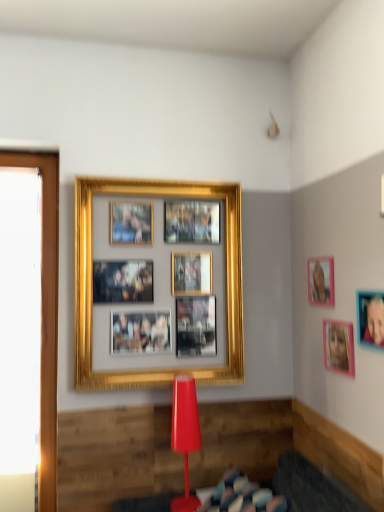
Question: From a real-world perspective, is pink matte picture frame at upper right, the 2th picture frame when ordered from left to right, physically below pink matte picture frame at upper right, positioned as the first picture frame in front-to-back order?

Choices:
 (A) yes
 (B) no

Answer: (B)

Question: Considering the relative sizes of pink matte picture frame at upper right, which appears as the 3th picture frame when viewed from the right, and pink matte picture frame at upper right, positioned as the first picture frame in front-to-back order, in the image provided, is pink matte picture frame at upper right, which appears as the 3th picture frame when viewed from the right, shorter than pink matte picture frame at upper right, positioned as the first picture frame in front-to-back order,?

Choices:
 (A) no
 (B) yes

Answer: (A)

Question: Is pink matte picture frame at upper right, acting as the 2th picture frame starting from the back, in front of pink matte picture frame at upper right, the 1th picture frame viewed from the right?

Choices:
 (A) yes
 (B) no

Answer: (B)

Question: Is pink matte picture frame at upper right, the 2th picture frame when ordered from left to right, positioned behind pink matte picture frame at upper right, positioned as the first picture frame in front-to-back order?

Choices:
 (A) no
 (B) yes

Answer: (B)

Question: Considering the relative sizes of pink matte picture frame at upper right, the 2th picture frame when ordered from left to right, and pink matte picture frame at upper right, the 1th picture frame viewed from the right, in the image provided, is pink matte picture frame at upper right, the 2th picture frame when ordered from left to right, bigger than pink matte picture frame at upper right, the 1th picture frame viewed from the right,?

Choices:
 (A) no
 (B) yes

Answer: (B)

Question: Is pink matte picture frame at upper right, acting as the 2th picture frame starting from the back, directly adjacent to pink matte picture frame at upper right, the fourth picture frame in the back-to-front sequence?

Choices:
 (A) no
 (B) yes

Answer: (A)

Question: Does matte red table lamp at center touch pink matte picture frame at upper right, positioned as the first picture frame in front-to-back order?

Choices:
 (A) no
 (B) yes

Answer: (A)

Question: Considering the relative sizes of matte red table lamp at center and pink matte picture frame at upper right, the 1th picture frame viewed from the right, in the image provided, is matte red table lamp at center bigger than pink matte picture frame at upper right, the 1th picture frame viewed from the right,?

Choices:
 (A) no
 (B) yes

Answer: (B)

Question: Considering the relative sizes of matte red table lamp at center and pink matte picture frame at upper right, the fourth picture frame in the back-to-front sequence, in the image provided, is matte red table lamp at center wider than pink matte picture frame at upper right, the fourth picture frame in the back-to-front sequence,?

Choices:
 (A) yes
 (B) no

Answer: (A)

Question: From a real-world perspective, does matte red table lamp at center sit lower than pink matte picture frame at upper right, the fourth picture frame in the back-to-front sequence?

Choices:
 (A) yes
 (B) no

Answer: (A)

Question: Considering the relative positions of matte red table lamp at center and pink matte picture frame at upper right, the 4th picture frame positioned from the left, in the image provided, is matte red table lamp at center to the right of pink matte picture frame at upper right, the 4th picture frame positioned from the left, from the viewer's perspective?

Choices:
 (A) yes
 (B) no

Answer: (B)

Question: Is matte red table lamp at center smaller than pink matte picture frame at upper right, the 1th picture frame viewed from the right?

Choices:
 (A) yes
 (B) no

Answer: (B)

Question: Can you confirm if pink matte picture frame at upper right, which appears as the 3th picture frame when viewed from the right, is taller than gold metallic picture frame at upper center, the first picture frame from the back?

Choices:
 (A) no
 (B) yes

Answer: (A)